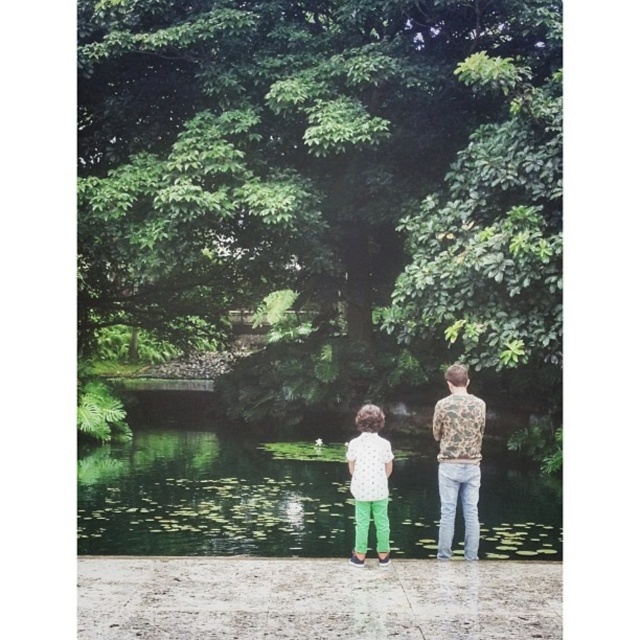
Question: Which of the following is the farthest from the observer?

Choices:
 (A) camouflage-patterned shirt at center
 (B) polka dot shirt at center
 (C) green lily pads at center

Answer: (A)

Question: Is green lily pads at center further to camera compared to polka dot shirt at center?

Choices:
 (A) no
 (B) yes

Answer: (B)

Question: Which point appears closest to the camera in this image?

Choices:
 (A) (456, 472)
 (B) (275, 467)

Answer: (A)

Question: Among these points, which one is farthest from the camera?

Choices:
 (A) (436, 403)
 (B) (99, 513)

Answer: (B)

Question: Does green lily pads at center lie behind camouflage-patterned shirt at center?

Choices:
 (A) no
 (B) yes

Answer: (A)

Question: Can you confirm if green lily pads at center is smaller than camouflage-patterned shirt at center?

Choices:
 (A) yes
 (B) no

Answer: (B)